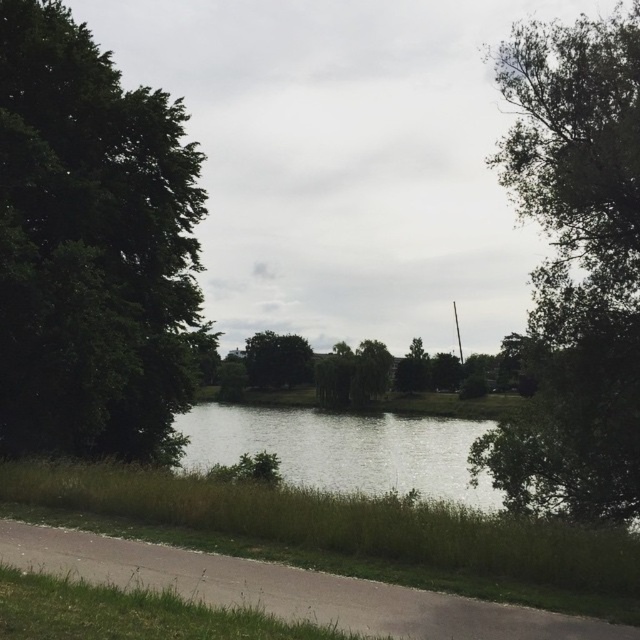
You are planning to place a small bench between the green leafy tree at left and the green leafy tree at center. Which tree has a wider trunk to ensure the bench is placed on the wider side?

The green leafy tree at center has a wider trunk than the green leafy tree at left, so placing the bench on its side would be better.

You are standing at the camera position and want to walk to the green leafy tree at left. The path is 2 meters wide. Can you walk directly to the tree without stepping off the path?

The distance between you and the green leafy tree at left is 18.83 meters. Since the path is 2 meters wide, you can walk directly to the tree without stepping off the path as long as the path leads straight to the tree. However, the scene description mentions the path curves gently, so you might need to follow the path to reach the tree.

You are standing on the paved path along the water and want to take a photo of both the green leafy tree at left and the green leafy tree at right. Which tree should you position yourself closer to in order to include both in the frame?

To include both the green leafy tree at left and the green leafy tree at right in the frame, you should position yourself closer to the green leafy tree at right since the green leafy tree at left is located below it, allowing for a wider angle to capture both.